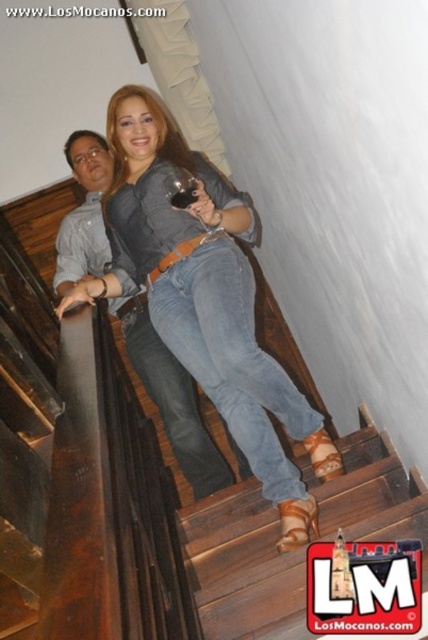
Question: Among these objects, which one is nearest to the camera?

Choices:
 (A) brushed metal shirt at upper left
 (B) matte black wine glass at upper center
 (C) jeans at center
 (D) brown wooden stairs at center

Answer: (D)

Question: Which object is positioned closest to the transparent glass at upper center?

Choices:
 (A) brown wooden stairs at center
 (B) jeans at center

Answer: (B)

Question: Is brushed metal shirt at upper left to the right of transparent glass at upper center from the viewer's perspective?

Choices:
 (A) yes
 (B) no

Answer: (B)

Question: Among these points, which one is farthest from the camera?

Choices:
 (A) (196, 352)
 (B) (74, 236)
 (C) (416, 497)

Answer: (B)

Question: Does jeans at center appear on the left side of matte black wine glass at upper center?

Choices:
 (A) yes
 (B) no

Answer: (B)

Question: Does transparent glass at upper center have a larger size compared to matte black wine glass at upper center?

Choices:
 (A) no
 (B) yes

Answer: (B)